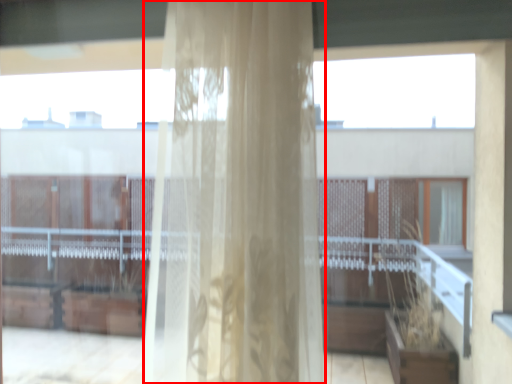
Question: From the image's perspective, where is curtain (annotated by the red box) located relative to glass window?

Choices:
 (A) below
 (B) above

Answer: (B)